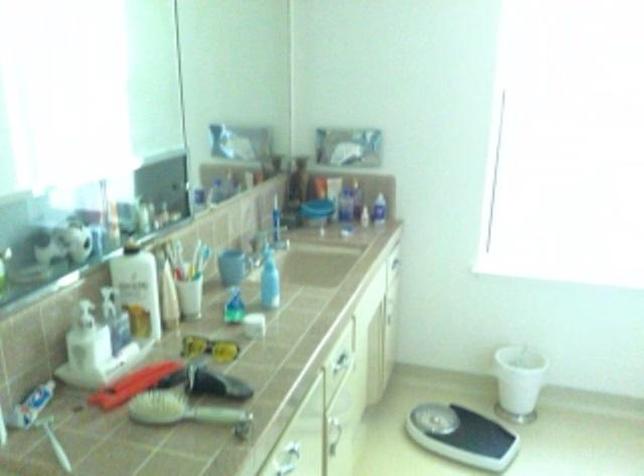
What do you see at coordinates (518, 382) in the screenshot?
I see `the white trash can` at bounding box center [518, 382].